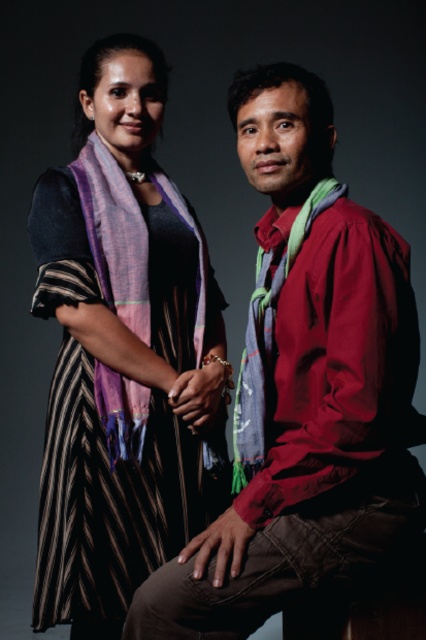
Locate an element on the screen. matte red shirt at center is located at coordinates (311, 444).

In the scene shown: Which is more to the right, striped fabric dress at center or blue textured scarf at center?

blue textured scarf at center is more to the right.

Which is in front, point (175, 374) or point (241, 364)?

Point (241, 364) is in front.

Where is `striped fabric dress at center`? striped fabric dress at center is located at coordinates (123, 353).

Can you confirm if striped fabric dress at center is wider than multicolored woven scarf at center?

Yes, striped fabric dress at center is wider than multicolored woven scarf at center.

Does point (175, 381) come closer to viewer compared to point (106, 392)?

No, (175, 381) is behind (106, 392).

Is point (92, 182) more distant than point (112, 442)?

Yes, it is.

Locate an element on the screen. The height and width of the screenshot is (640, 426). striped fabric dress at center is located at coordinates (123, 353).